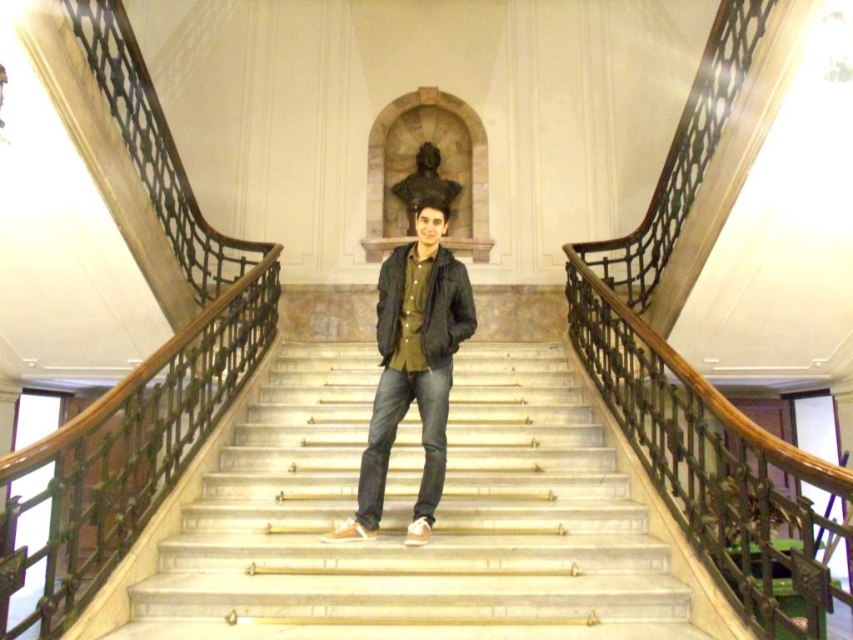
You are an interior designer assessing the layout of this grand staircase. You notice the white marble stairs at center and the dark green matte jacket at center. Which object is closer to the viewer in this scene?

The white marble stairs at center is in front of the dark green matte jacket at center, so the white marble stairs at center is closer to the viewer.

You are standing at the bottom of the white marble stairs at center and want to reach the dark green fabric jacket at center. Which direction should you move to get closer to the jacket?

Since the white marble stairs at center are closer to the viewer than the dark green fabric jacket at center, you should move upwards along the stairs to get closer to the dark green fabric jacket at center.

You are an event planner organizing a photoshoot in the grand staircase. You need to position two models wearing the dark green fabric jacket at center and the dark green matte jacket at center so that they are both visible in the same frame. Based on their current positions, which jacket is positioned to the left of the other?

The dark green fabric jacket at center is positioned to the left of the dark green matte jacket at center.